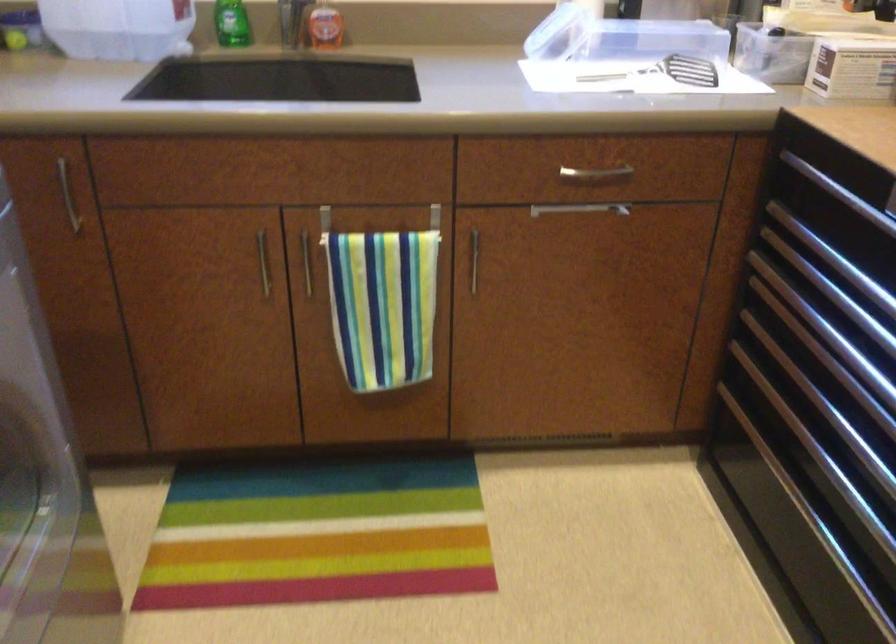
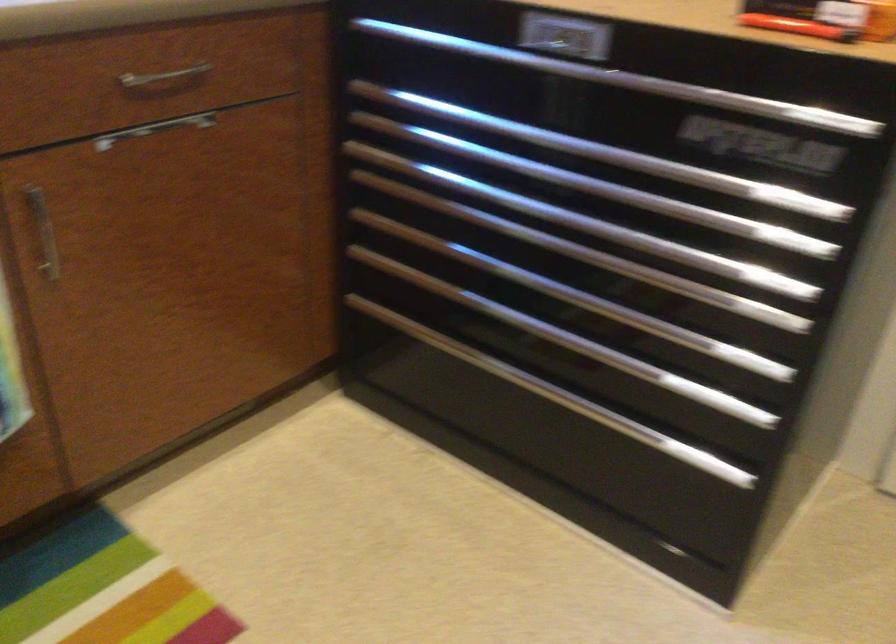
Question: How did the camera likely rotate?

Choices:
 (A) Left
 (B) Right
 (C) Up
 (D) Down

Answer: (B)